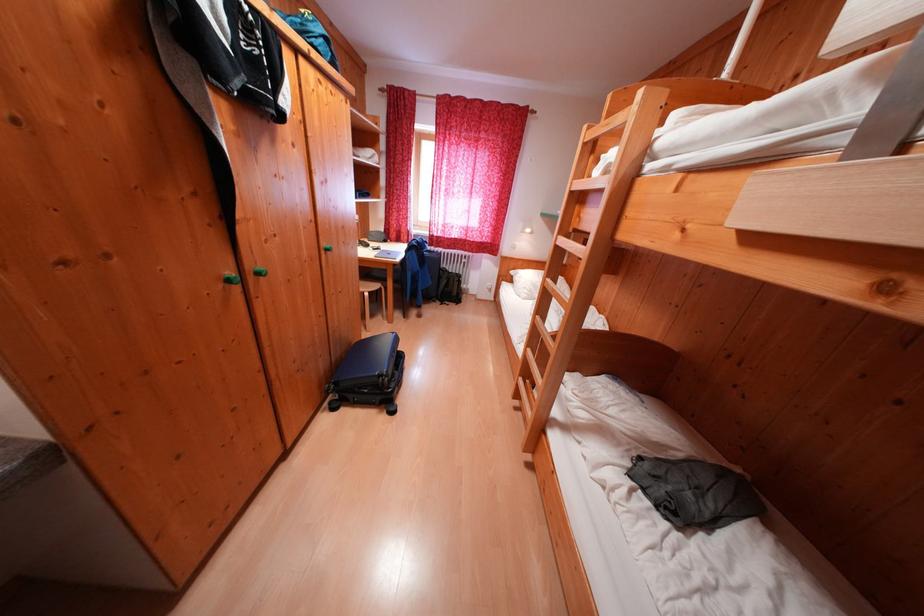
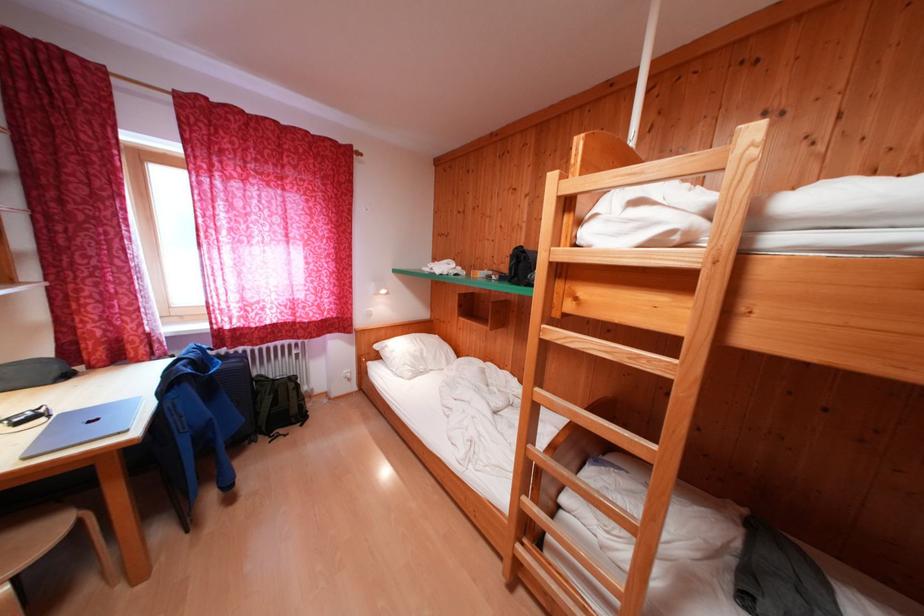
The point at (518, 284) is marked in the first image. Where is the corresponding point in the second image?

(385, 361)